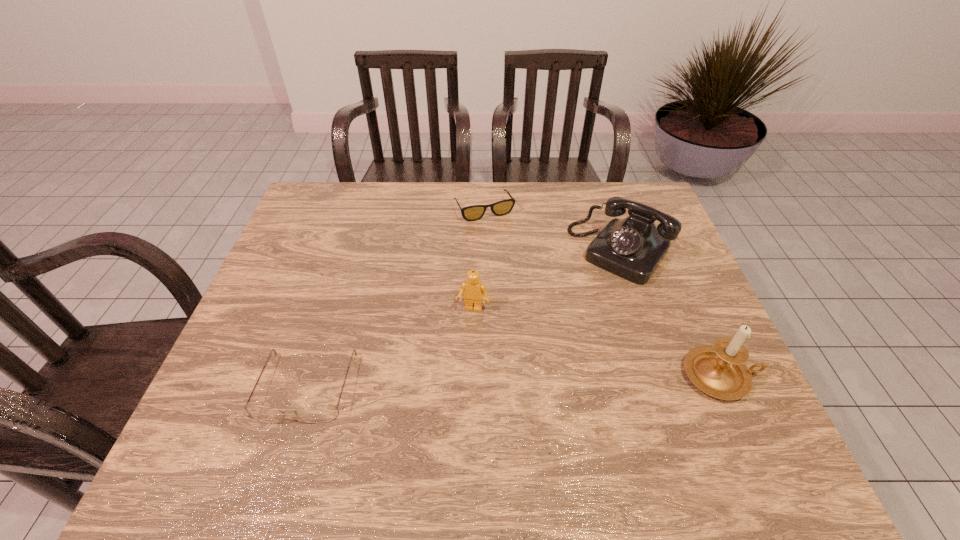
Locate an element on the screen. vacant region between the sunglasses and the tallest object is located at coordinates (602, 293).

The width and height of the screenshot is (960, 540). I want to click on free space between the tallest object and the third farthest object, so click(x=597, y=342).

This screenshot has width=960, height=540. In order to click on empty location between the tallest object and the third tallest object in this screenshot , I will do `click(597, 342)`.

Where is `vacant space that's between the candle holder and the telephone`? The height and width of the screenshot is (540, 960). vacant space that's between the candle holder and the telephone is located at coordinates (670, 314).

The width and height of the screenshot is (960, 540). In order to click on empty space between the third farthest object and the tallest object in this screenshot , I will do `click(597, 342)`.

This screenshot has height=540, width=960. Identify the location of free point between the leftmost object and the third farthest object. (390, 348).

This screenshot has height=540, width=960. I want to click on vacant area that lies between the telephone and the third shortest object, so click(x=546, y=280).

Where is `empty space between the third nearest object and the candle holder`? empty space between the third nearest object and the candle holder is located at coordinates (597, 342).

Where is `empty space that is in between the candle holder and the sunglasses`? empty space that is in between the candle holder and the sunglasses is located at coordinates (x=602, y=293).

At what (x,y) coordinates should I click in order to perform the action: click on empty space that is in between the third tallest object and the leftmost object. Please return your answer as a coordinate pair (x, y). Looking at the image, I should click on (390, 348).